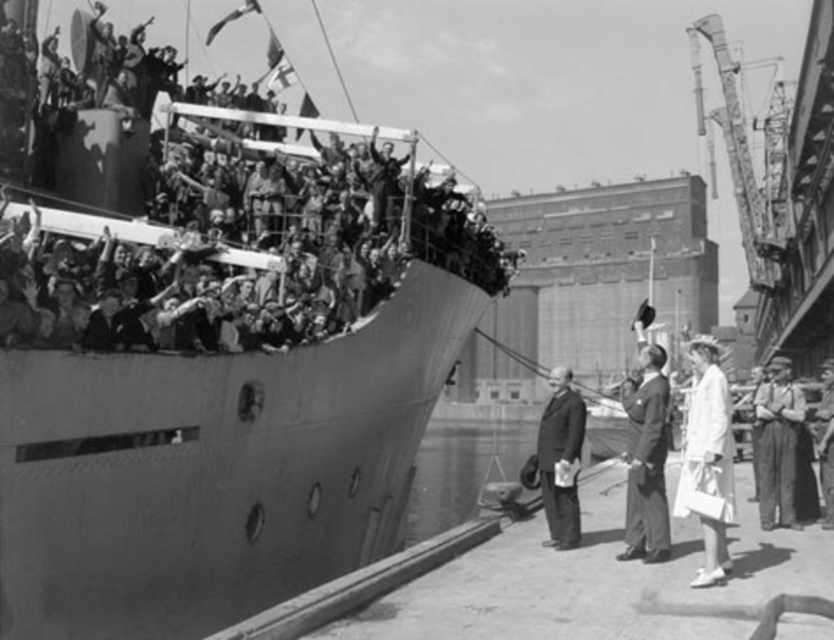
You are a photographer positioned at the bow of the ship. You want to capture a photo that includes both the white fabric dress at lower right and the smooth black suit at center. Given the distance between them, will you need to adjust your camera to a wider angle to ensure both are in frame?

The white fabric dress at lower right is 9.16 meters from the smooth black suit at center. To include both in the frame, you would need to adjust your camera to a wider angle since the distance between them is significant.